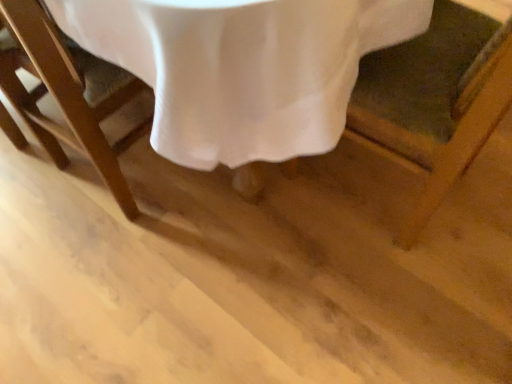
This screenshot has height=384, width=512. What are the coordinates of `vacant space underneath wooden chair at lower right (from a real-world perspective)` in the screenshot? It's located at (366, 184).